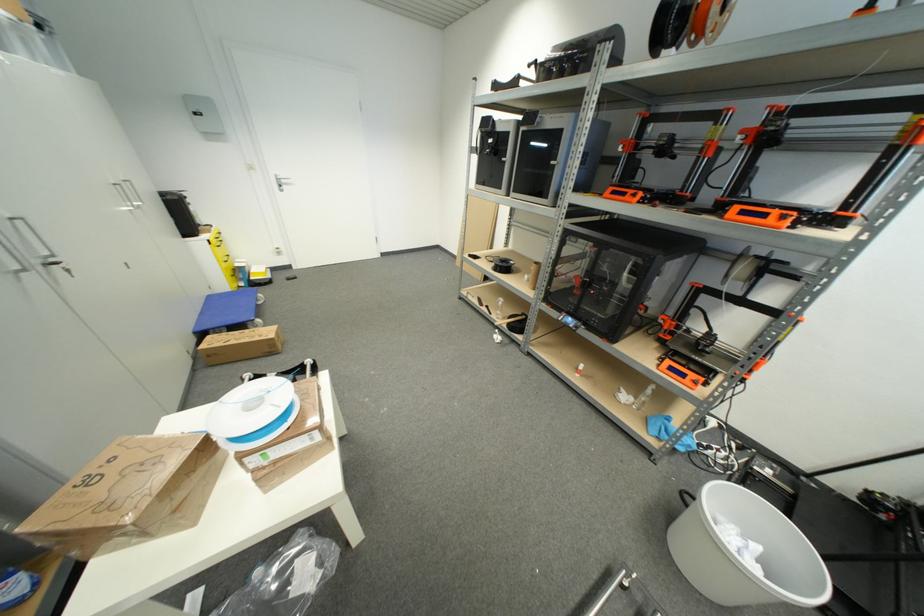
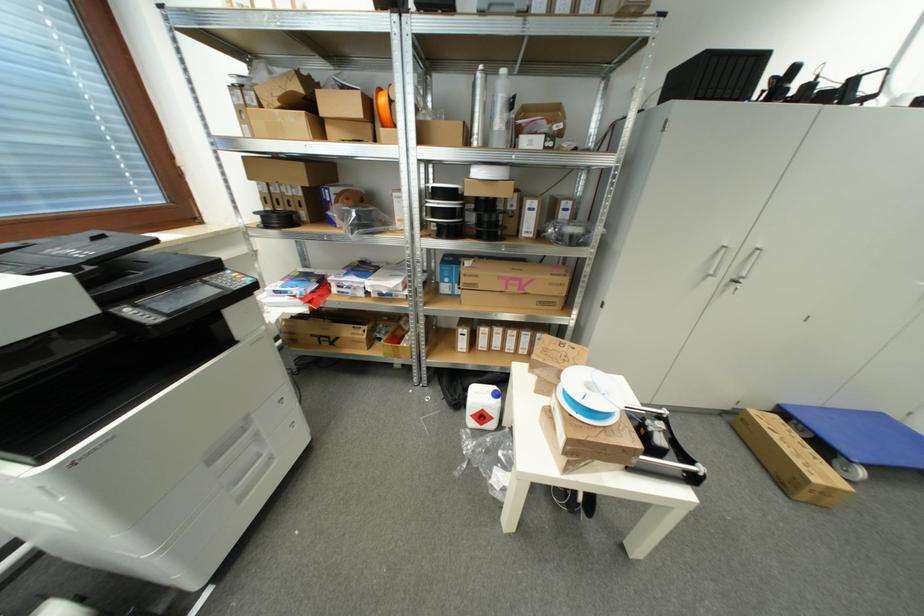
Locate, in the second image, the point that corresponds to the point at 213,299 in the first image.

(885, 418)